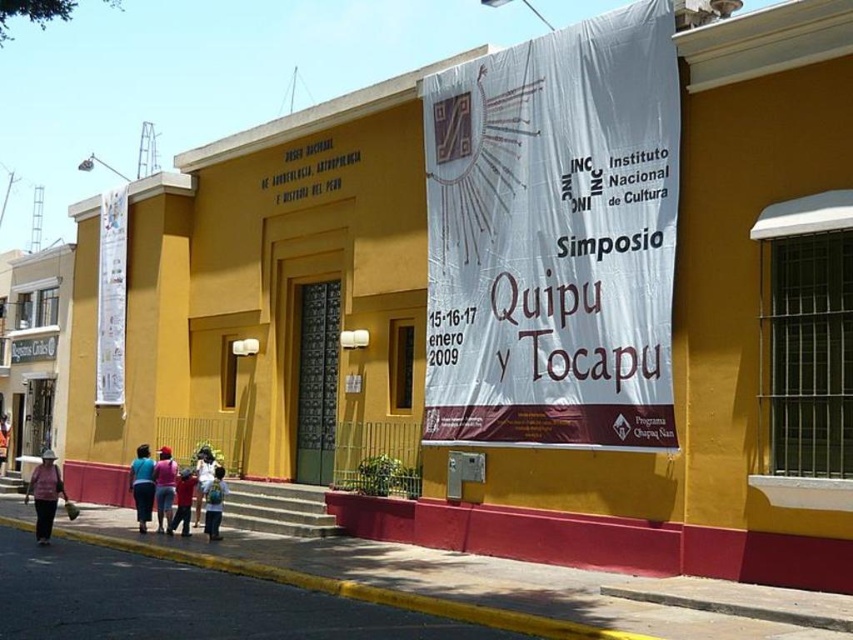
You are standing in front of the yellow building with a red base. You want to locate the white paper banner at upper center. According to its 2D coordinates, where should you look relative to the building?

The white paper banner at upper center is located at the coordinates 0.373 on the x axis and 0.651 on the y axis relative to the building.

You are standing in front of the yellow building with a red base. You see two points marked on the building. The first point is at coordinates point(51, 515) and the second is at point(144, 481). From your perspective, which point is closer to you?

Point(51, 515) is in front of point(144, 481), so it is closer to you.

You are an event planner looking at this image of a building. You need to hang a new banner that is the same size as the blue fabric shirt at lower left. Where should you place the new banner to match the size of the existing white paper banner at upper center?

The white paper banner at upper center is smaller than the blue fabric shirt at lower left. To match the size of the existing white paper banner at upper center, the new banner should be placed where the white paper banner is currently located, but since you want it to be the same size as the blue fabric shirt at lower left, you would need to place it in a location where a larger banner can fit, such as the right side of the building where the existing large banner is hung.